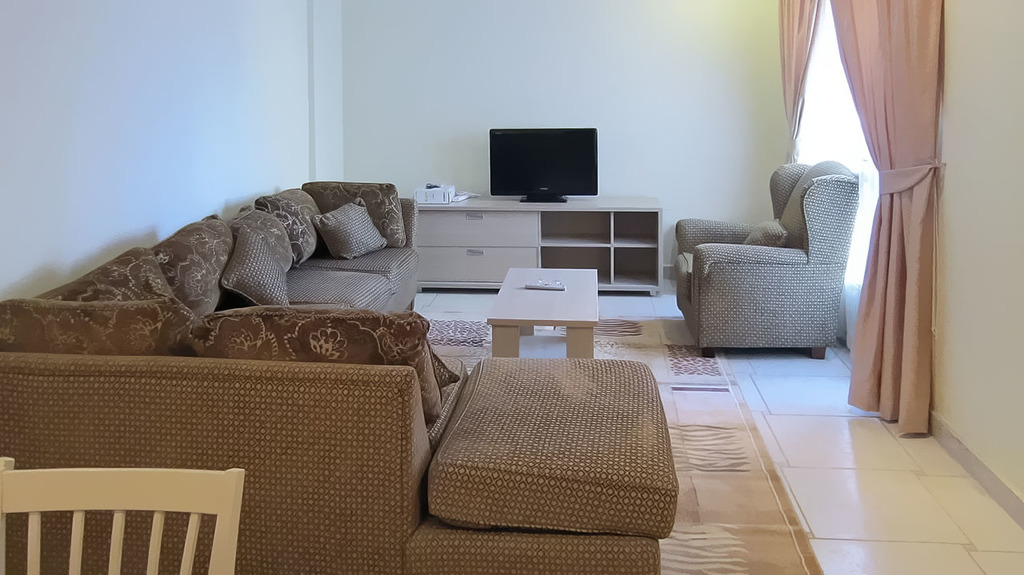
Find the location of a particular element. cubbies is located at coordinates (587, 231), (645, 225), (636, 260), (601, 255).